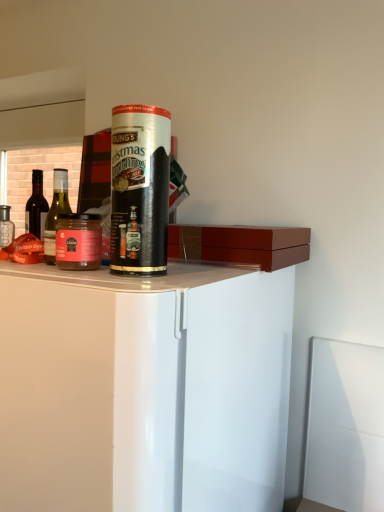
Question: Does matte glass bottle at left, the first bottle in the left-to-right sequence, come behind transparent plastic straw at center?

Choices:
 (A) yes
 (B) no

Answer: (A)

Question: Does matte glass bottle at left, the 2th bottle when ordered from right to left, have a smaller size compared to transparent plastic straw at center?

Choices:
 (A) yes
 (B) no

Answer: (A)

Question: Is matte glass bottle at left, the 2th bottle when ordered from right to left, taller than transparent plastic straw at center?

Choices:
 (A) yes
 (B) no

Answer: (B)

Question: From a real-world perspective, is matte glass bottle at left, which is the 1th bottle from back to front, on top of transparent plastic straw at center?

Choices:
 (A) yes
 (B) no

Answer: (B)

Question: Are matte glass bottle at left, the 2th bottle when ordered from right to left, and transparent plastic straw at center located far from each other?

Choices:
 (A) no
 (B) yes

Answer: (A)

Question: Is matte glass jar at left to the left or to the right of green glass bottle at left, acting as the 1th bottle starting from the front, in the image?

Choices:
 (A) right
 (B) left

Answer: (A)

Question: Is matte glass jar at left spatially inside green glass bottle at left, acting as the 1th bottle starting from the front, or outside of it?

Choices:
 (A) inside
 (B) outside

Answer: (B)

Question: Considering the positions of matte glass jar at left and green glass bottle at left, positioned as the 1th bottle in right-to-left order, in the image, is matte glass jar at left taller or shorter than green glass bottle at left, positioned as the 1th bottle in right-to-left order,?

Choices:
 (A) tall
 (B) short

Answer: (B)

Question: Considering the positions of matte glass jar at left and green glass bottle at left, positioned as the 1th bottle in right-to-left order, in the image, is matte glass jar at left wider or thinner than green glass bottle at left, positioned as the 1th bottle in right-to-left order,?

Choices:
 (A) wide
 (B) thin

Answer: (A)

Question: Is point (59, 198) closer or farther from the camera than point (137, 141)?

Choices:
 (A) closer
 (B) farther

Answer: (B)

Question: Is green glass bottle at left, acting as the 1th bottle starting from the front, to the left or to the right of transparent plastic straw at center in the image?

Choices:
 (A) left
 (B) right

Answer: (A)

Question: Considering the positions of green glass bottle at left, which is the second bottle in back-to-front order, and transparent plastic straw at center in the image, is green glass bottle at left, which is the second bottle in back-to-front order, wider or thinner than transparent plastic straw at center?

Choices:
 (A) thin
 (B) wide

Answer: (A)

Question: From the image's perspective, is green glass bottle at left, which is the 2th bottle from left to right, positioned above or below transparent plastic straw at center?

Choices:
 (A) above
 (B) below

Answer: (B)

Question: Does point (57, 214) appear closer or farther from the camera than point (41, 193)?

Choices:
 (A) farther
 (B) closer

Answer: (B)

Question: From the image's perspective, relative to matte glass bottle at left, the 2th bottle when ordered from right to left, is green glass bottle at left, which is the second bottle in back-to-front order, above or below?

Choices:
 (A) below
 (B) above

Answer: (A)